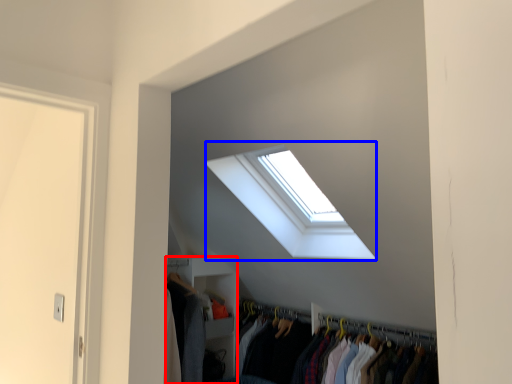
Question: Which object is further to the camera taking this photo, closet (highlighted by a red box) or window (highlighted by a blue box)?

Choices:
 (A) closet
 (B) window

Answer: (A)